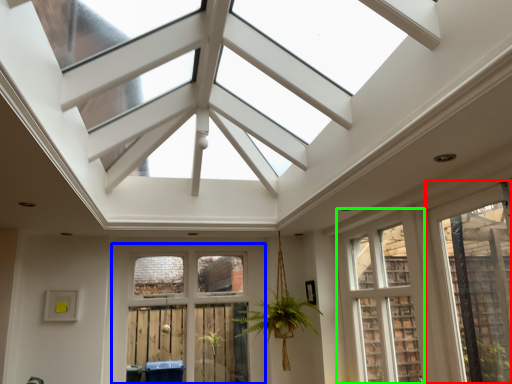
Question: Estimate the real-world distances between objects in this image. Which object is farther from window (highlighted by a red box), window (highlighted by a blue box) or window (highlighted by a green box)?

Choices:
 (A) window
 (B) window

Answer: (A)